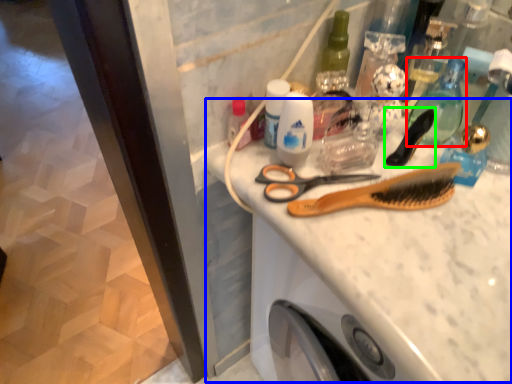
Question: Estimate the real-world distances between objects in this image. Which object is farther from mouthwash (highlighted by a red box), counter top (highlighted by a blue box) or brush (highlighted by a green box)?

Choices:
 (A) counter top
 (B) brush

Answer: (A)